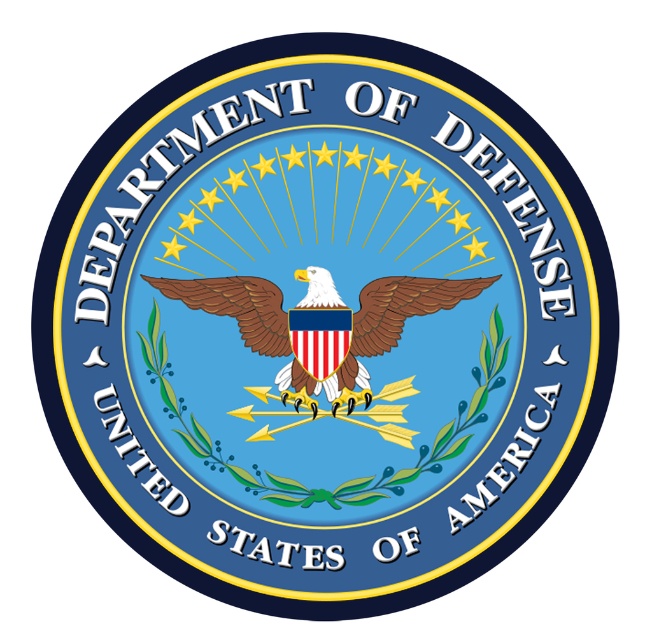
What do you see at coordinates (319, 323) in the screenshot? This screenshot has height=640, width=652. I see `brown matte eagle at center` at bounding box center [319, 323].

Does brown matte eagle at center appear under blue matte text at lower right?

No.

The height and width of the screenshot is (640, 652). I want to click on brown matte eagle at center, so click(x=319, y=323).

Can you confirm if brown matte eagle at center is bigger than blue glossy text at center?

Indeed, brown matte eagle at center has a larger size compared to blue glossy text at center.

Who is more forward, (336, 404) or (280, 548)?

Positioned in front is point (336, 404).

Where is `brown matte eagle at center`? The width and height of the screenshot is (652, 640). brown matte eagle at center is located at coordinates (319, 323).

Is blue matte text at lower right bigger than blue glossy text at center?

Indeed, blue matte text at lower right has a larger size compared to blue glossy text at center.

Can you confirm if blue matte text at lower right is positioned to the right of blue glossy text at center?

Indeed, blue matte text at lower right is positioned on the right side of blue glossy text at center.

What do you see at coordinates (501, 468) in the screenshot? I see `blue matte text at lower right` at bounding box center [501, 468].

This screenshot has width=652, height=640. Identify the location of blue matte text at lower right. (501, 468).